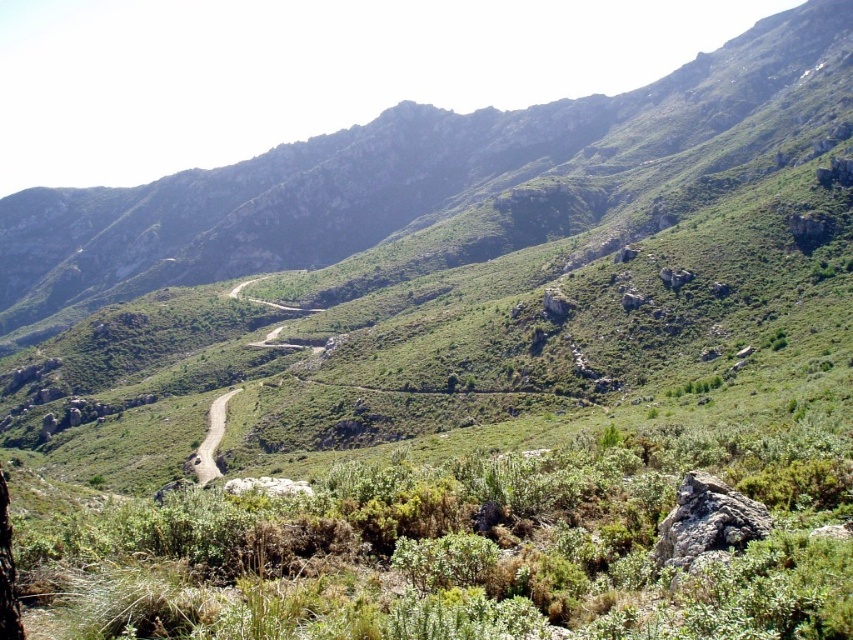
You are navigating a mountain trail and come across a rugged landscape with a winding dirt road. You notice a green shrubbery at center. Based on its position, can you determine if the shrubbery is closer to the road or the distant hills?

The green shrubbery at center is located at point (479, 548), which places it closer to the road than the distant hills.